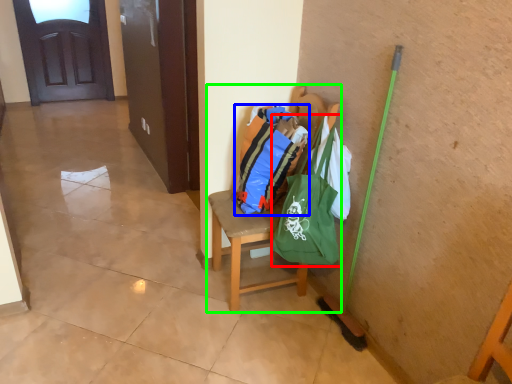
Question: Estimate the real-world distances between objects in this image. Which object is farther from shoulder bag (highlighted by a red box), shopping bag (highlighted by a blue box) or chair (highlighted by a green box)?

Choices:
 (A) shopping bag
 (B) chair

Answer: (B)